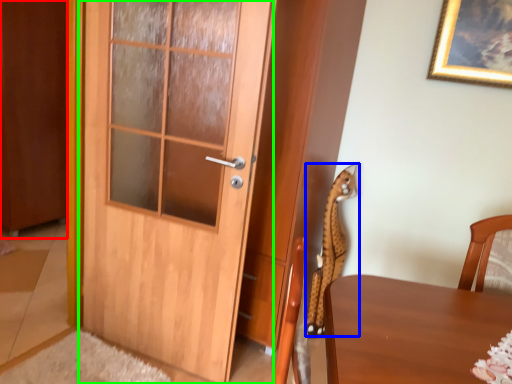
Question: Which object is positioned farthest from barn door (highlighted by a red box)? Select from animal (highlighted by a blue box) and door (highlighted by a green box).

Choices:
 (A) animal
 (B) door

Answer: (A)